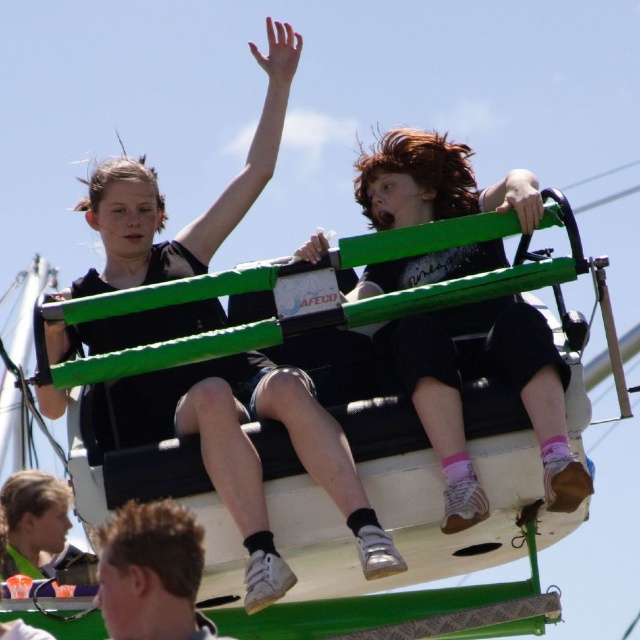
Question: Does green painted metal amusement ride at center have a greater width compared to matte black shorts at center?

Choices:
 (A) no
 (B) yes

Answer: (B)

Question: Does green painted metal amusement ride at center appear on the right side of matte black shorts at center?

Choices:
 (A) no
 (B) yes

Answer: (B)

Question: Which object appears farthest from the camera in this image?

Choices:
 (A) matte black shorts at center
 (B) green painted metal amusement ride at center

Answer: (B)

Question: Does green painted metal amusement ride at center appear over matte black shorts at center?

Choices:
 (A) yes
 (B) no

Answer: (B)